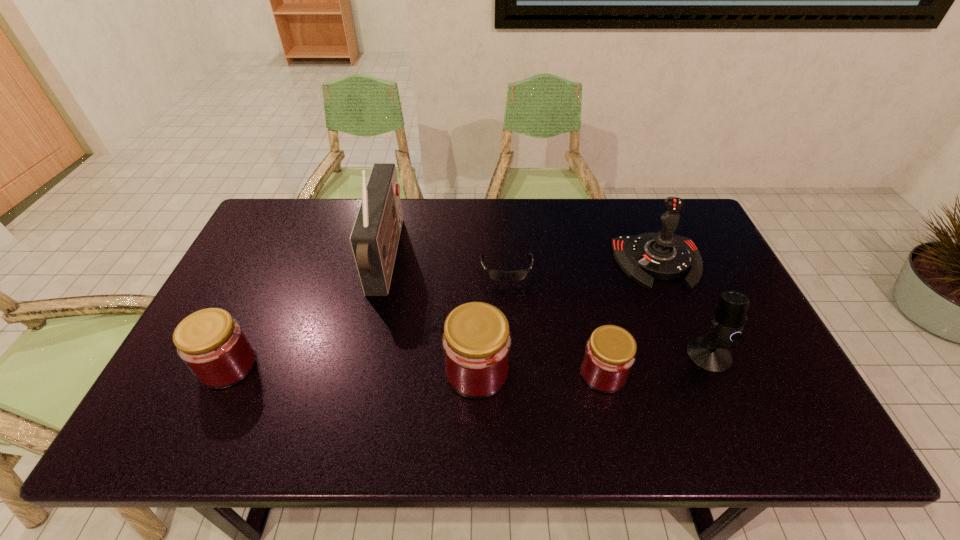
Identify which jam is the nearest to the microphone. Please provide its 2D coordinates. Your answer should be formatted as a tuple, i.e. [(x, y)], where the tuple contains the x and y coordinates of a point satisfying the conditions above.

[(610, 352)]

Identify which jam is the second closest to the sunglasses. Please provide its 2D coordinates. Your answer should be formatted as a tuple, i.e. [(x, y)], where the tuple contains the x and y coordinates of a point satisfying the conditions above.

[(610, 352)]